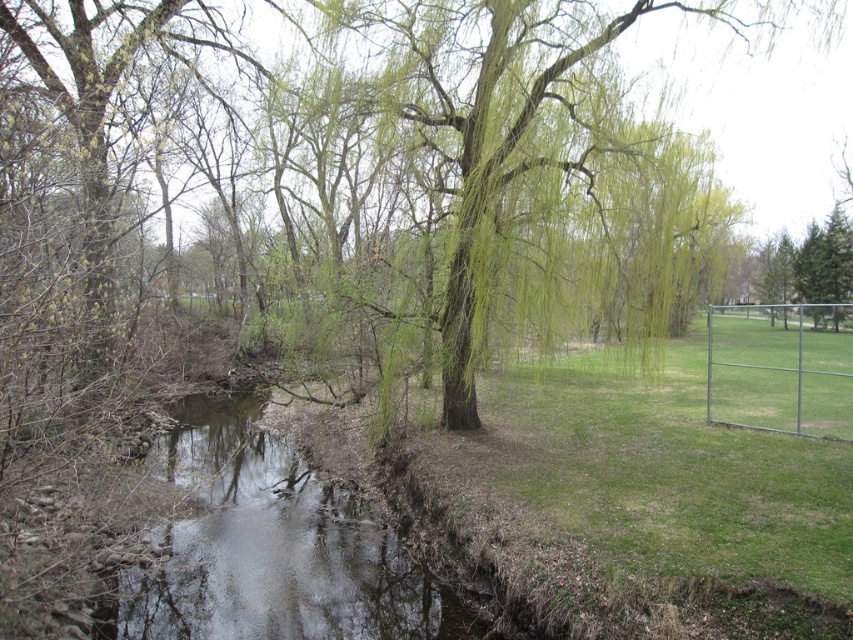
You are standing at the edge of the stream and want to cross to the other side. The metallic silver fence at right is blocking your path. Can you walk around the fence to reach the clear water at center?

The clear water at center is to the left of the metallic silver fence at right, so you can walk around the fence to the left side to reach the clear water at center.

You are planning to cross the stream using a small wooden plank. The plank is 2 meters long. Based on the scene, will the plank be long enough to span the clear water at center if the green leafy willow at center is 3 meters wide?

The clear water at center is narrower than the green leafy willow at center, which is 3 meters wide. Therefore, the 2 meter plank may not be long enough to span the clear water at center if it is narrower than 2 meters. However, since the willow is wider than the water, the actual width of the water could vary. Without exact measurements, it is uncertain if the plank will suffice.